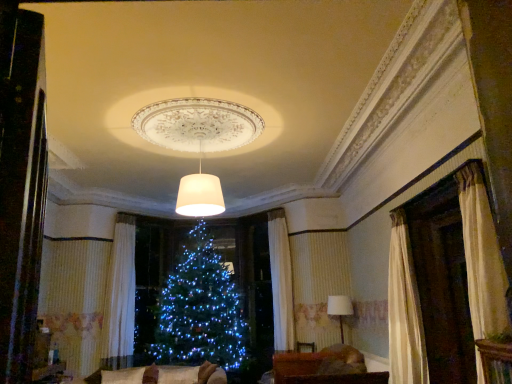
Question: Is white matte lampshade at center, positioned as the 1th lamp in front-to-back order, in front of or behind velvet beige couch at lower center in the image?

Choices:
 (A) behind
 (B) front

Answer: (B)

Question: Looking at their shapes, would you say white matte lampshade at center, which is the second lamp from back to front, is wider or thinner than velvet beige couch at lower center?

Choices:
 (A) wide
 (B) thin

Answer: (B)

Question: Which object is positioned farthest from the white fabric lampshade at right, positioned as the 2th lamp in top-to-bottom order?

Choices:
 (A) white matte lampshade at center, which ranks as the first lamp in left-to-right order
 (B) white textured curtain at left
 (C) velvet beige couch at lower center
 (D) brown fabric couch at lower center

Answer: (B)

Question: Considering the real-world distances, which object is farthest from the white matte lampshade at center, which is counted as the 2th lamp, starting from the bottom?

Choices:
 (A) brown fabric couch at lower center
 (B) white fabric lampshade at right, which is counted as the 2th lamp, starting from the left
 (C) velvet beige couch at lower center
 (D) white textured curtain at left

Answer: (B)